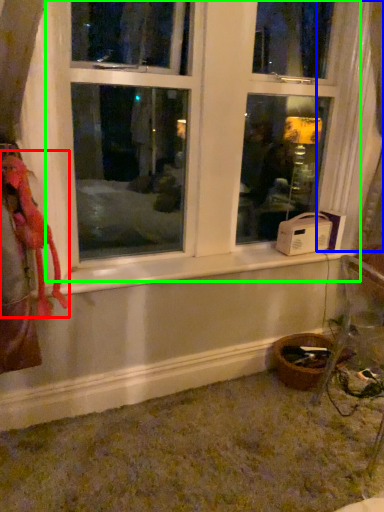
Question: Which is farther away from animal (highlighted by a red box)? curtain (highlighted by a blue box) or window (highlighted by a green box)?

Choices:
 (A) curtain
 (B) window

Answer: (A)